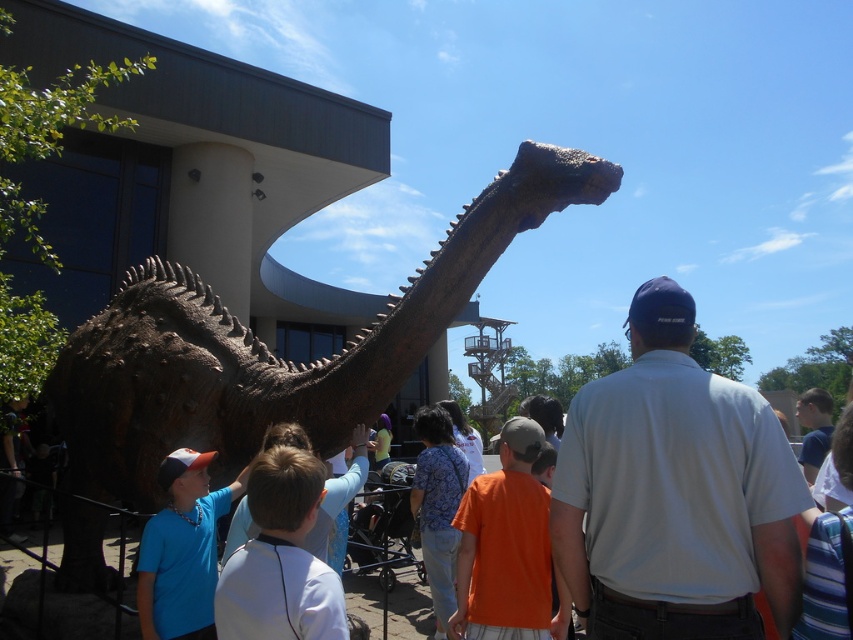
Is light blue shirt at center closer to camera compared to floral shirt at center?

Yes, it is in front of floral shirt at center.

Who is more distant from viewer, (262, 515) or (454, 490)?

The point (454, 490) is behind.

The height and width of the screenshot is (640, 853). In order to click on light blue shirt at center in this screenshot , I will do `click(280, 557)`.

Is orange cotton shirt at center shorter than blue shirt at upper right?

Yes, orange cotton shirt at center is shorter than blue shirt at upper right.

Between orange cotton shirt at center and blue shirt at upper right, which one has less height?

orange cotton shirt at center is shorter.

Between point (495, 483) and point (811, 452), which one is positioned in front?

Point (495, 483) is more forward.

Locate an element on the screen. orange cotton shirt at center is located at coordinates (508, 548).

Is rustic wood statue at center to the left of blue shirt at upper right from the viewer's perspective?

Yes, rustic wood statue at center is to the left of blue shirt at upper right.

Is point (102, 404) positioned in front of point (820, 452)?

Yes, point (102, 404) is closer to viewer.

What do you see at coordinates (270, 352) in the screenshot?
I see `rustic wood statue at center` at bounding box center [270, 352].

Where is `rustic wood statue at center`? rustic wood statue at center is located at coordinates (270, 352).